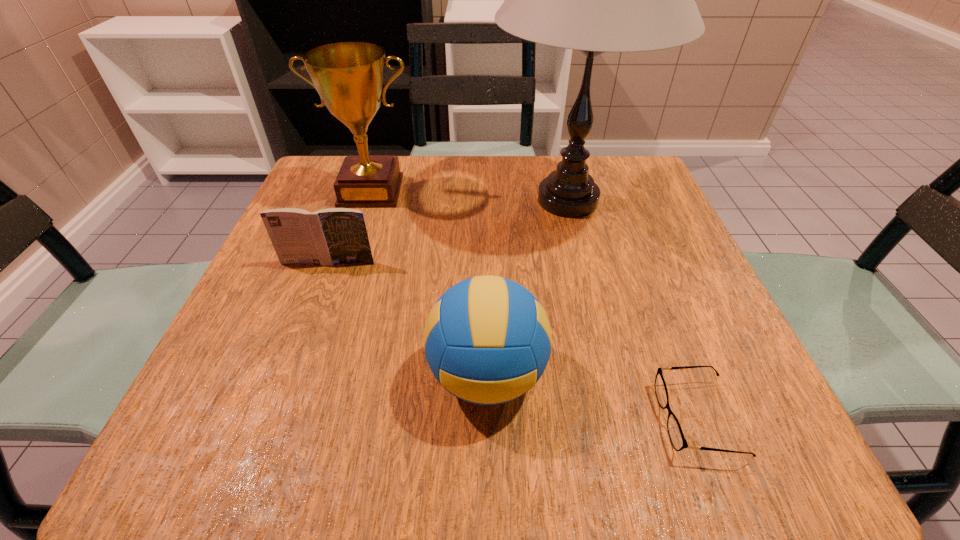
Locate an element on the screen. the tallest object is located at coordinates (595, 0).

Identify the location of award. The height and width of the screenshot is (540, 960). (349, 77).

Locate an element on the screen. The width and height of the screenshot is (960, 540). volleyball is located at coordinates (487, 340).

This screenshot has height=540, width=960. Find the location of `the second shortest object`. the second shortest object is located at coordinates (326, 237).

The image size is (960, 540). Identify the location of book. (326, 237).

Image resolution: width=960 pixels, height=540 pixels. Find the location of `spectacles`. spectacles is located at coordinates (678, 441).

You are a GUI agent. You are given a task and a screenshot of the screen. Output one action in this format:
    pyautogui.click(x=<x>, y=<y>)
    Task: Click on the free space located on the front of the lamp
    
    Given the screenshot: What is the action you would take?
    pyautogui.click(x=605, y=349)

Identify the location of vacant space located on the plaque of the award. The width and height of the screenshot is (960, 540). (335, 305).

I want to click on free location located on the back of the volleyball, so click(485, 251).

Image resolution: width=960 pixels, height=540 pixels. In order to click on free space located 0.360m on the front cover of the book in this screenshot , I will do `click(258, 454)`.